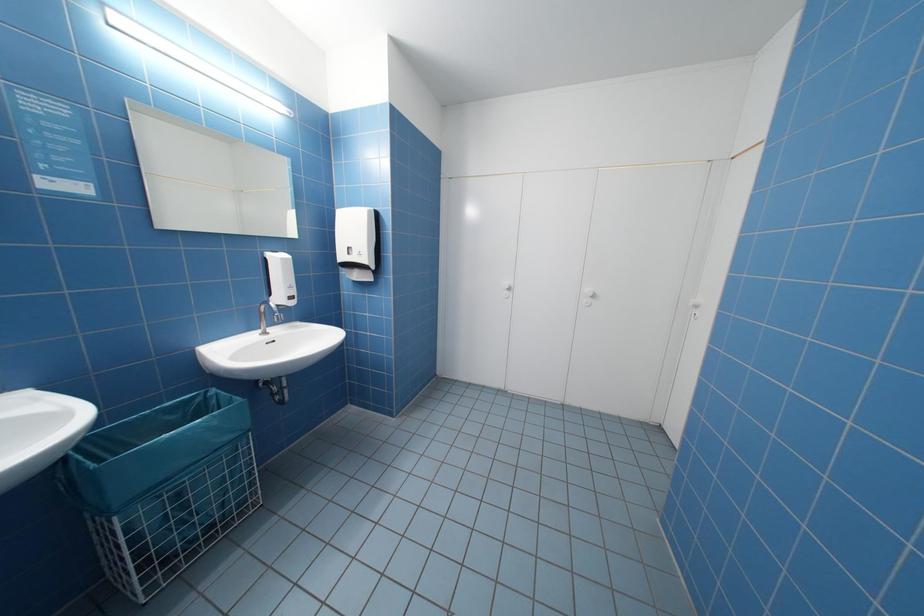
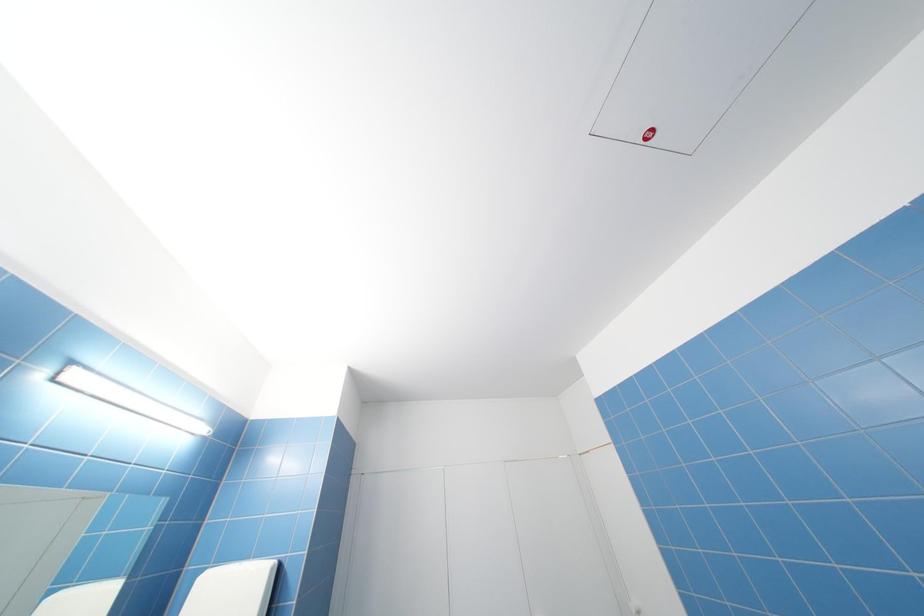
The first image is from the beginning of the video and the second image is from the end. How did the camera likely rotate when shooting the video?

The camera's rotation is toward right-up.